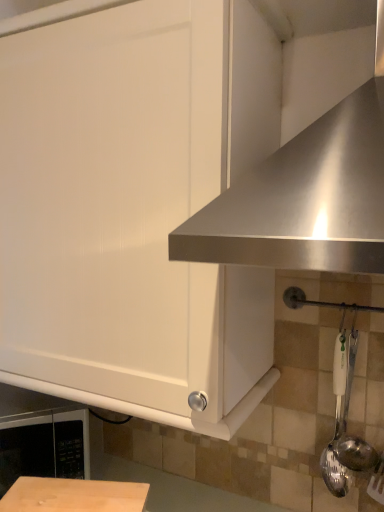
Describe the element at coordinates (135, 209) in the screenshot. I see `white matte cabinet at upper left` at that location.

Identify the location of white matte cabinet at upper left. (135, 209).

Describe the element at coordinates (41, 437) in the screenshot. I see `black matte microwave at lower left` at that location.

Locate an element on the screen. black matte microwave at lower left is located at coordinates [41, 437].

Identify the location of white matte cabinet at upper left. (135, 209).

Between white matte cabinet at upper left and satin silver spoon at right, acting as the first utensil starting from the left, which one has smaller size?

satin silver spoon at right, acting as the first utensil starting from the left, is smaller.

Which of these two, white matte cabinet at upper left or satin silver spoon at right, acting as the first utensil starting from the left, stands taller?

white matte cabinet at upper left.

From the image's perspective, is white matte cabinet at upper left above or below satin silver spoon at right, acting as the first utensil starting from the left?

white matte cabinet at upper left is situated higher than satin silver spoon at right, acting as the first utensil starting from the left, in the image.

Is black matte microwave at lower left at the right side of satin silver spoon at right, acting as the first utensil starting from the left?

No.

From a real-world perspective, is black matte microwave at lower left positioned above or below satin silver spoon at right, which ranks as the 2th utensil in right-to-left order?

From a real-world perspective, black matte microwave at lower left is physically below satin silver spoon at right, which ranks as the 2th utensil in right-to-left order.

Is point (13, 475) positioned after point (334, 384)?

Yes, it is.

Is black matte microwave at lower left shorter than satin silver spoon at right, which ranks as the 2th utensil in right-to-left order?

Yes.

Is stainless steel exhaust hood at upper right oriented towards satin silver spoon at right, which ranks as the 2th utensil in right-to-left order?

No, stainless steel exhaust hood at upper right does not turn towards satin silver spoon at right, which ranks as the 2th utensil in right-to-left order.

Is stainless steel exhaust hood at upper right situated inside satin silver spoon at right, which ranks as the 2th utensil in right-to-left order, or outside?

stainless steel exhaust hood at upper right lies outside satin silver spoon at right, which ranks as the 2th utensil in right-to-left order.

Is stainless steel exhaust hood at upper right in front of or behind satin silver spoon at right, which ranks as the 2th utensil in right-to-left order, in the image?

Visually, stainless steel exhaust hood at upper right is located in front of satin silver spoon at right, which ranks as the 2th utensil in right-to-left order.

Considering the sizes of objects stainless steel exhaust hood at upper right and satin silver spoon at right, acting as the first utensil starting from the left, in the image provided, who is bigger, stainless steel exhaust hood at upper right or satin silver spoon at right, acting as the first utensil starting from the left,?

stainless steel exhaust hood at upper right is bigger.

Which point is more distant from viewer, (308,234) or (57,48)?

The point (57,48) is farther from the camera.

Is stainless steel exhaust hood at upper right not within white matte cabinet at upper left?

Yes, stainless steel exhaust hood at upper right is outside of white matte cabinet at upper left.

Is stainless steel exhaust hood at upper right oriented away from white matte cabinet at upper left?

No, stainless steel exhaust hood at upper right's orientation is not away from white matte cabinet at upper left.

Is stainless steel exhaust hood at upper right to the right of white matte cabinet at upper left from the viewer's perspective?

Yes.

Find the location of a particular element. This screenshot has height=512, width=384. the 2nd utensil behind the stainless steel exhaust hood at upper right is located at coordinates (337, 424).

How much distance is there between satin silver spoon at right, which ranks as the 2th utensil in right-to-left order, and stainless steel exhaust hood at upper right?

satin silver spoon at right, which ranks as the 2th utensil in right-to-left order, and stainless steel exhaust hood at upper right are 17.92 inches apart from each other.

Can stainless steel exhaust hood at upper right be found inside satin silver spoon at right, acting as the first utensil starting from the left?

No, stainless steel exhaust hood at upper right is not inside satin silver spoon at right, acting as the first utensil starting from the left.

Is satin silver spoon at right, acting as the first utensil starting from the left, with stainless steel exhaust hood at upper right?

No.

Is white matte cabinet at upper left looking in the opposite direction of stainless steel exhaust hood at upper right?

No.

From their relative heights in the image, would you say white matte cabinet at upper left is taller or shorter than stainless steel exhaust hood at upper right?

Clearly, white matte cabinet at upper left is taller compared to stainless steel exhaust hood at upper right.

Can we say white matte cabinet at upper left lies outside stainless steel exhaust hood at upper right?

white matte cabinet at upper left is positioned outside stainless steel exhaust hood at upper right.

Is stainless steel exhaust hood at upper right taller or shorter than black matte microwave at lower left?

In the image, stainless steel exhaust hood at upper right appears to be taller than black matte microwave at lower left.

In the image, there is a black matte microwave at lower left. At what (x,y) coordinates should I click in order to perform the action: click on exhaust hood above it (from the image's perspective). Please return your answer as a coordinate pair (x, y). Looking at the image, I should click on (304, 199).

Could you measure the distance between stainless steel exhaust hood at upper right and black matte microwave at lower left?

stainless steel exhaust hood at upper right is 25.51 inches away from black matte microwave at lower left.

Would you consider stainless steel exhaust hood at upper right to be distant from black matte microwave at lower left?

No, stainless steel exhaust hood at upper right is not far from black matte microwave at lower left.

Find the location of a particular element. cabinetry that appears in front of the satin silver spoon at right, acting as the first utensil starting from the left is located at coordinates (135, 209).

You are a GUI agent. You are given a task and a screenshot of the screen. Output one action in this format:
    pyautogui.click(x=<x>, y=<y>)
    Task: Click on the appliance below the satin silver spoon at right, acting as the first utensil starting from the left (from a real-world perspective)
    The image size is (384, 512).
    Given the screenshot: What is the action you would take?
    pyautogui.click(x=41, y=437)

Which object lies nearer to the anchor point stainless steel exhaust hood at upper right, black matte microwave at lower left or white plastic spoon at lower right, which appears as the 1th utensil when viewed from the right?

white plastic spoon at lower right, which appears as the 1th utensil when viewed from the right.

Estimate the real-world distances between objects in this image. Which object is further from white plastic spoon at lower right, which appears as the 1th utensil when viewed from the right, black matte microwave at lower left or satin silver spoon at right, which ranks as the 2th utensil in right-to-left order?

The object further to white plastic spoon at lower right, which appears as the 1th utensil when viewed from the right, is black matte microwave at lower left.

When comparing their distances from stainless steel exhaust hood at upper right, does black matte microwave at lower left or white matte cabinet at upper left seem closer?

Based on the image, white matte cabinet at upper left appears to be nearer to stainless steel exhaust hood at upper right.

Which object lies further to the anchor point black matte microwave at lower left, stainless steel exhaust hood at upper right or white matte cabinet at upper left?

The object further to black matte microwave at lower left is stainless steel exhaust hood at upper right.

Estimate the real-world distances between objects in this image. Which object is further from white plastic spoon at lower right, which appears as the 1th utensil when viewed from the right, satin silver spoon at right, acting as the first utensil starting from the left, or white matte cabinet at upper left?

white matte cabinet at upper left lies further to white plastic spoon at lower right, which appears as the 1th utensil when viewed from the right, than the other object.

Considering their positions, is stainless steel exhaust hood at upper right positioned further to white matte cabinet at upper left than white plastic spoon at lower right, arranged as the second utensil when viewed from the left?

white plastic spoon at lower right, arranged as the second utensil when viewed from the left.

Which object lies nearer to the anchor point white matte cabinet at upper left, white plastic spoon at lower right, which appears as the 1th utensil when viewed from the right, or stainless steel exhaust hood at upper right?

The object closer to white matte cabinet at upper left is stainless steel exhaust hood at upper right.

Based on their spatial positions, is satin silver spoon at right, which ranks as the 2th utensil in right-to-left order, or white plastic spoon at lower right, arranged as the second utensil when viewed from the left, further from white matte cabinet at upper left?

Among the two, white plastic spoon at lower right, arranged as the second utensil when viewed from the left, is located further to white matte cabinet at upper left.

Find the location of a particular element. The height and width of the screenshot is (512, 384). cabinetry between black matte microwave at lower left and white plastic spoon at lower right, arranged as the second utensil when viewed from the left, from left to right is located at coordinates (135, 209).

Locate an element on the screen. cabinetry between black matte microwave at lower left and satin silver spoon at right, acting as the first utensil starting from the left, from left to right is located at coordinates (135, 209).

Locate an element on the screen. Image resolution: width=384 pixels, height=512 pixels. utensil between black matte microwave at lower left and white plastic spoon at lower right, arranged as the second utensil when viewed from the left, in the horizontal direction is located at coordinates (337, 424).

The height and width of the screenshot is (512, 384). Identify the location of utensil between stainless steel exhaust hood at upper right and satin silver spoon at right, acting as the first utensil starting from the left, from top to bottom. (346, 424).